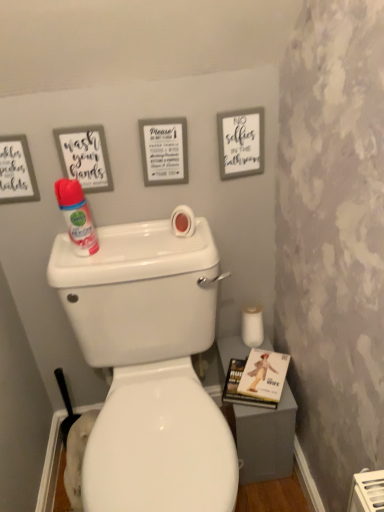
Question: Is white matte toilet paper at lower right, which is the second toilet paper in front-to-back order, to the right of matte white sign at upper center, arranged as the second picture frame when viewed from the left, from the viewer's perspective?

Choices:
 (A) yes
 (B) no

Answer: (A)

Question: Considering the relative sizes of white matte toilet paper at lower right, which is counted as the 1th toilet paper, starting from the back, and matte white sign at upper center, which is the second picture frame from right to left, in the image provided, is white matte toilet paper at lower right, which is counted as the 1th toilet paper, starting from the back, bigger than matte white sign at upper center, which is the second picture frame from right to left,?

Choices:
 (A) yes
 (B) no

Answer: (B)

Question: Is white matte toilet paper at lower right, which appears as the 2th toilet paper when viewed from the left, closer to camera compared to matte white sign at upper center, which is the second picture frame from right to left?

Choices:
 (A) no
 (B) yes

Answer: (A)

Question: Considering the relative positions of white matte toilet paper at lower right, which appears as the 2th toilet paper when viewed from the left, and matte white sign at upper center, which is the second picture frame from right to left, in the image provided, is white matte toilet paper at lower right, which appears as the 2th toilet paper when viewed from the left, to the left of matte white sign at upper center, which is the second picture frame from right to left, from the viewer's perspective?

Choices:
 (A) yes
 (B) no

Answer: (B)

Question: From the image's perspective, is white matte toilet paper at lower right, which is the second toilet paper in front-to-back order, above matte white sign at upper center, arranged as the second picture frame when viewed from the left?

Choices:
 (A) yes
 (B) no

Answer: (B)

Question: Is white matte toilet paper at lower right, placed as the 1th toilet paper when sorted from right to left, behind matte white sign at upper center, which is the second picture frame from right to left?

Choices:
 (A) no
 (B) yes

Answer: (B)

Question: Is white glossy toilet at center not within pink matte toilet paper at upper center, the 1th toilet paper viewed from the left?

Choices:
 (A) yes
 (B) no

Answer: (A)

Question: Can you confirm if white glossy toilet at center is positioned to the left of pink matte toilet paper at upper center, the 1th toilet paper viewed from the left?

Choices:
 (A) yes
 (B) no

Answer: (A)

Question: Can you confirm if white glossy toilet at center is bigger than pink matte toilet paper at upper center, the 1th toilet paper viewed from the left?

Choices:
 (A) no
 (B) yes

Answer: (B)

Question: Is white glossy toilet at center not near pink matte toilet paper at upper center, the 1th toilet paper viewed from the left?

Choices:
 (A) no
 (B) yes

Answer: (A)

Question: Could you tell me if white glossy toilet at center is facing pink matte toilet paper at upper center, marked as the second toilet paper in a bottom-to-top arrangement?

Choices:
 (A) yes
 (B) no

Answer: (B)

Question: From a real-world perspective, is white glossy toilet at center physically below pink matte toilet paper at upper center, marked as the second toilet paper in a bottom-to-top arrangement?

Choices:
 (A) yes
 (B) no

Answer: (A)

Question: Does pink matte toilet paper at upper center, arranged as the 1th toilet paper when viewed from the top, appear on the right side of matte white sign at upper center, arranged as the second picture frame when viewed from the left?

Choices:
 (A) yes
 (B) no

Answer: (A)